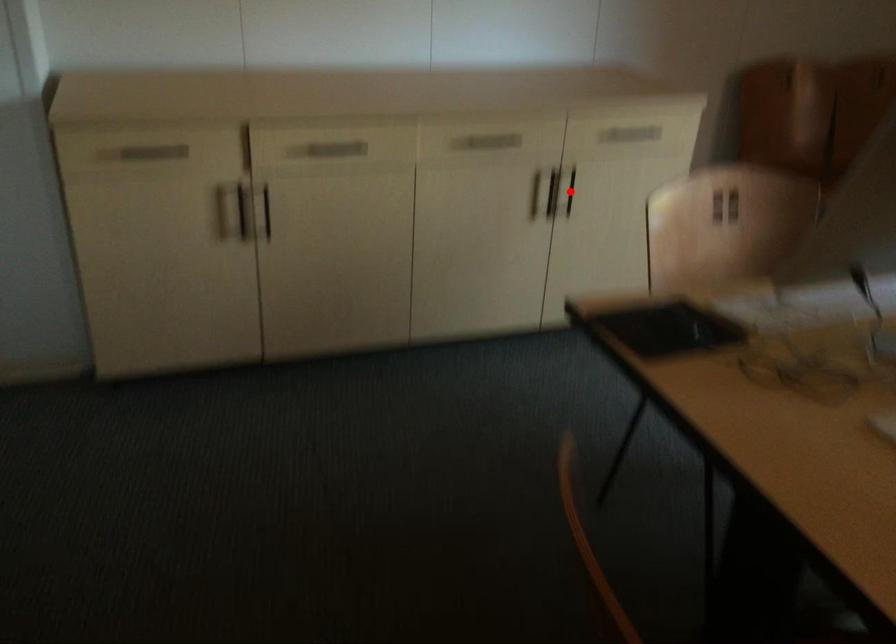
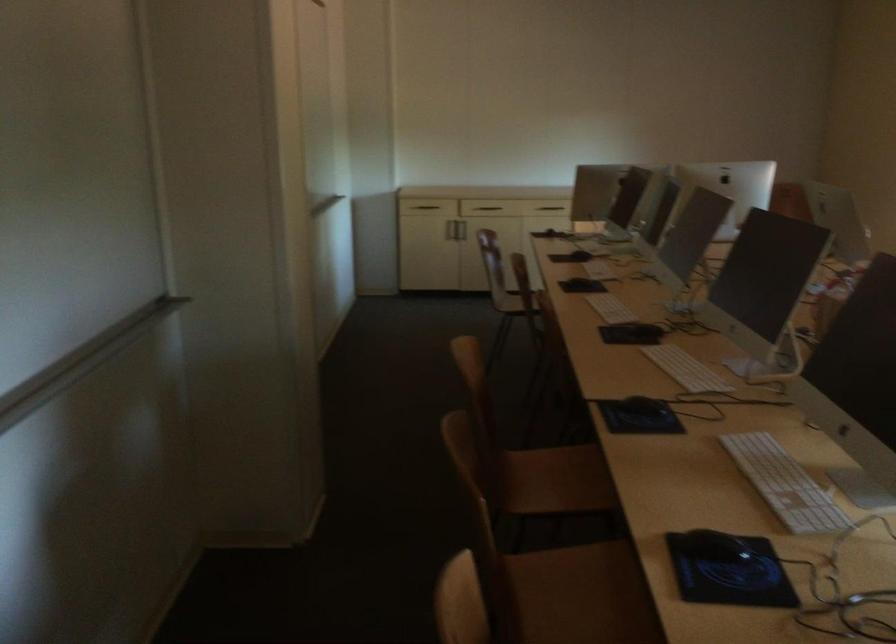
Question: I am providing you with two images of the same scene from different viewpoints. A red point is marked on the first image. At the location where the point appears in image 1, is it still visible in image 2?

Choices:
 (A) Yes
 (B) No

Answer: (B)